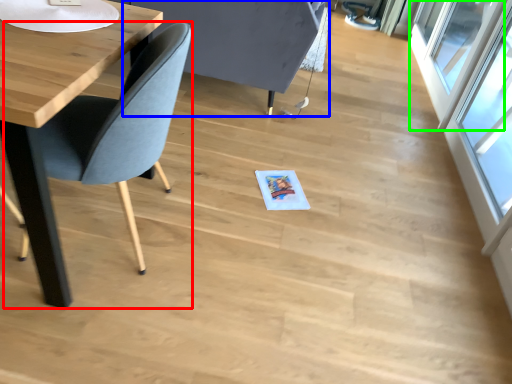
Question: Which object is the farthest from chair (highlighted by a red box)? Choose among these: swivel chair (highlighted by a blue box) or window (highlighted by a green box).

Choices:
 (A) swivel chair
 (B) window

Answer: (B)